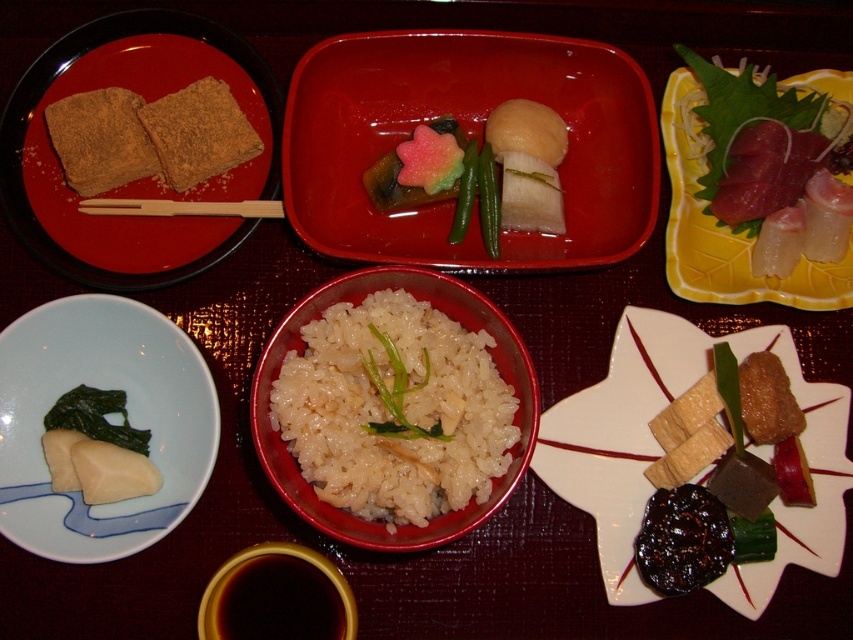
This screenshot has width=853, height=640. In order to click on yellow leaf-shaped plate at upper right in this screenshot , I will do `click(726, 228)`.

Between yellow leaf-shaped plate at upper right and shiny brown cube at lower right, which one appears on the right side from the viewer's perspective?

yellow leaf-shaped plate at upper right is more to the right.

This screenshot has height=640, width=853. Describe the element at coordinates (726, 228) in the screenshot. I see `yellow leaf-shaped plate at upper right` at that location.

Find the location of a particular element. yellow leaf-shaped plate at upper right is located at coordinates (726, 228).

Is white polished rice at center smaller than dark brown liquid at bottom center?

No, white polished rice at center is not smaller than dark brown liquid at bottom center.

Which is below, white polished rice at center or dark brown liquid at bottom center?

dark brown liquid at bottom center is lower down.

Does point (340, 344) lie in front of point (264, 624)?

Yes, it is.

The width and height of the screenshot is (853, 640). What are the coordinates of `white polished rice at center` in the screenshot? It's located at (393, 410).

Does shiny red lacquer tray at center appear on the right side of white polished rice at center?

Correct, you'll find shiny red lacquer tray at center to the right of white polished rice at center.

This screenshot has height=640, width=853. I want to click on shiny red lacquer tray at center, so click(x=469, y=136).